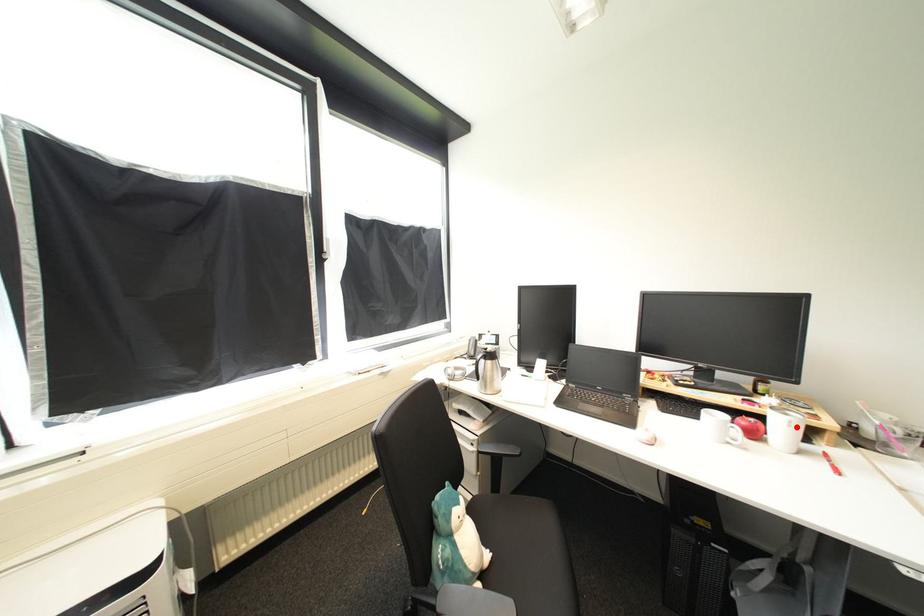
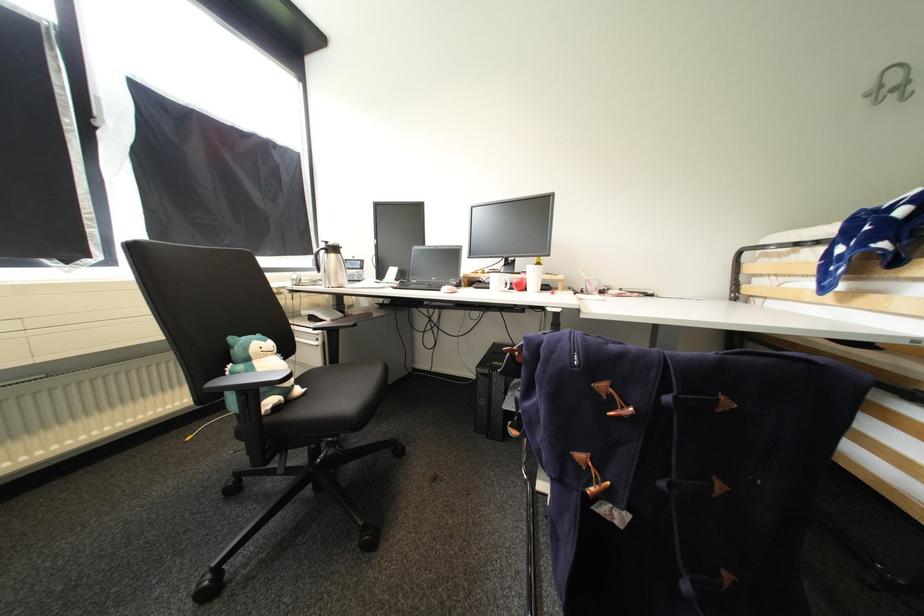
Where in the second image is the point corresponding to the highlighted location from the first image?

(541, 273)